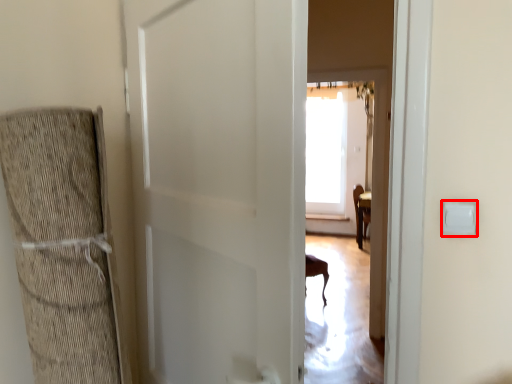
Question: From the image's perspective, where is light switch (annotated by the red box) located in relation to door in the image?

Choices:
 (A) above
 (B) below

Answer: (A)